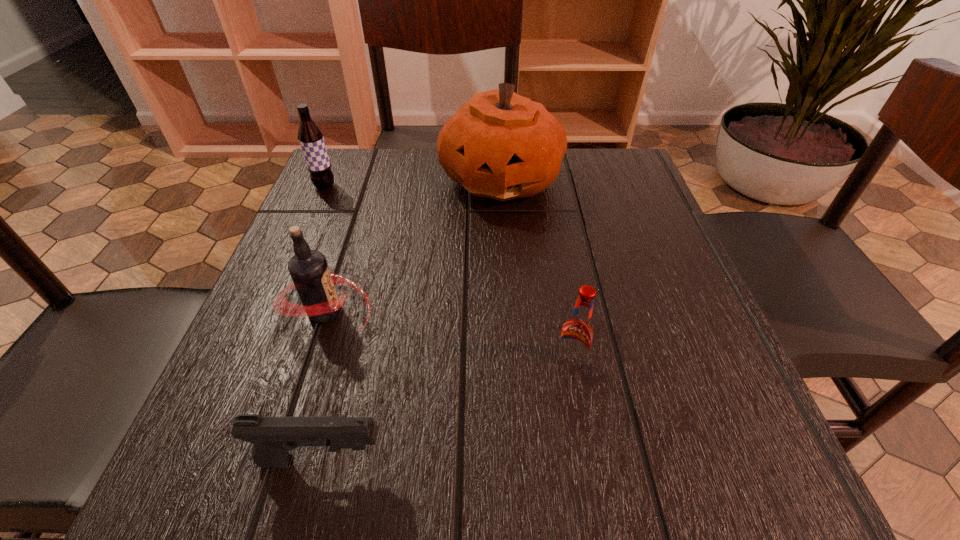
You are a GUI agent. You are given a task and a screenshot of the screen. Output one action in this format:
    pyautogui.click(x=<x>, y=<y>)
    Task: Click on the empty space between the pistol and the pumpkin
    This screenshot has height=540, width=960.
    Given the screenshot: What is the action you would take?
    pyautogui.click(x=412, y=320)

Where is `free point between the third nearest object and the nearest object`? Image resolution: width=960 pixels, height=540 pixels. free point between the third nearest object and the nearest object is located at coordinates (324, 386).

Identify the location of free point between the nearest root beer and the shortest object. Image resolution: width=960 pixels, height=540 pixels. (446, 412).

This screenshot has height=540, width=960. Identify the location of vacant space that's between the pumpkin and the shortest object. (412, 320).

This screenshot has height=540, width=960. In order to click on object that stands as the third closest to the second farthest root beer in this screenshot , I will do `click(310, 137)`.

Identify which object is located as the fourth nearest to the nearest object. Please provide its 2D coordinates. Your answer should be formatted as a tuple, i.e. [(x, y)], where the tuple contains the x and y coordinates of a point satisfying the conditions above.

[(310, 137)]

Point out which root beer is positioned as the second nearest to the second nearest root beer. Please provide its 2D coordinates. Your answer should be formatted as a tuple, i.e. [(x, y)], where the tuple contains the x and y coordinates of a point satisfying the conditions above.

[(577, 333)]

You are a GUI agent. You are given a task and a screenshot of the screen. Output one action in this format:
    pyautogui.click(x=<x>, y=<y>)
    Task: Click on the root beer that is the third closest one to the pistol
    This screenshot has width=960, height=540.
    Given the screenshot: What is the action you would take?
    [x=310, y=137]

In order to click on vacant space that satisfies the following two spatial constraints: 1. on the front-facing side of the rightmost root beer; 2. on the left side of the pumpkin in this screenshot , I will do `click(512, 363)`.

In order to click on vacant region that satisfies the following two spatial constraints: 1. on the front-facing side of the tallest object; 2. on the right side of the rightmost root beer in this screenshot , I will do `click(512, 363)`.